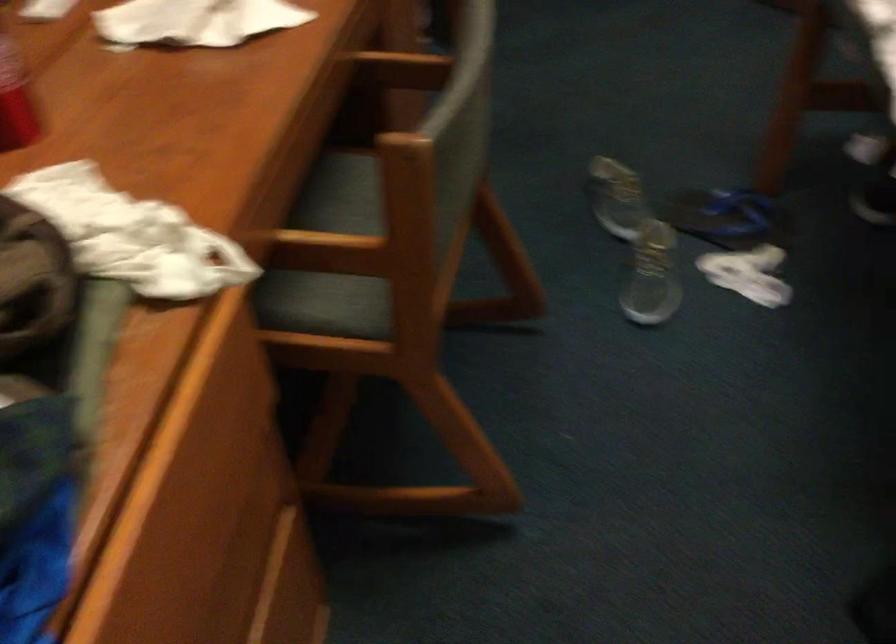
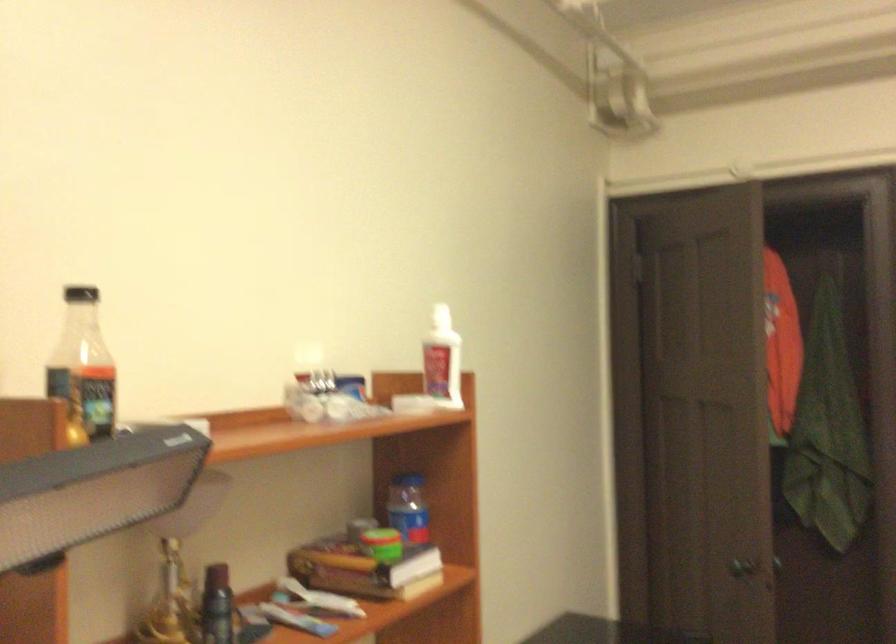
How did the camera likely rotate?

The camera rotated toward left-up.